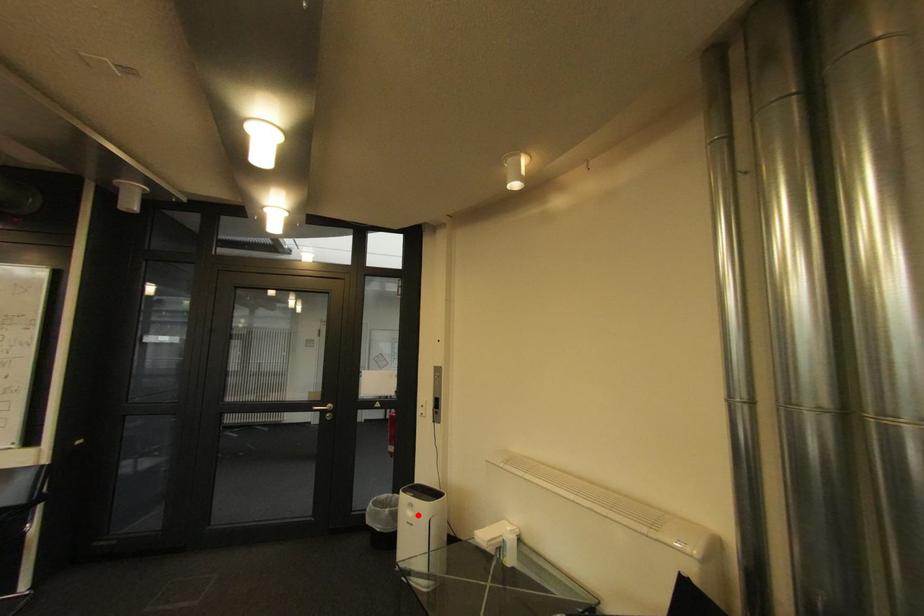
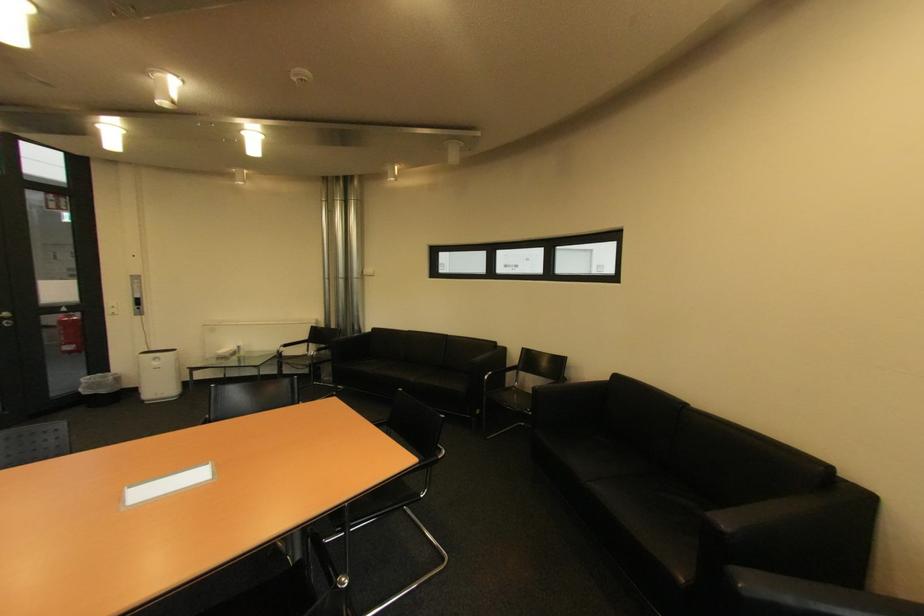
In the second image, find the point that corresponds to the highlighted location in the first image.

(164, 363)